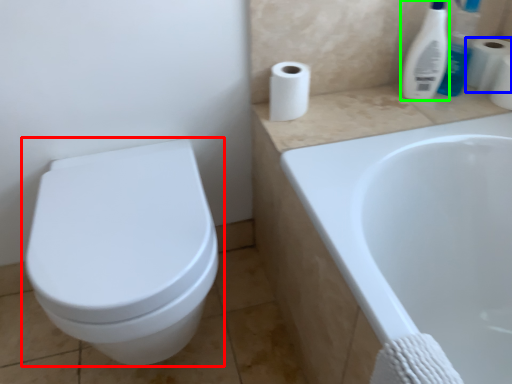
Question: Estimate the real-world distances between objects in this image. Which object is closer to toilet (highlighted by a red box), toilet paper (highlighted by a blue box) or cleaning product (highlighted by a green box)?

Choices:
 (A) toilet paper
 (B) cleaning product

Answer: (B)